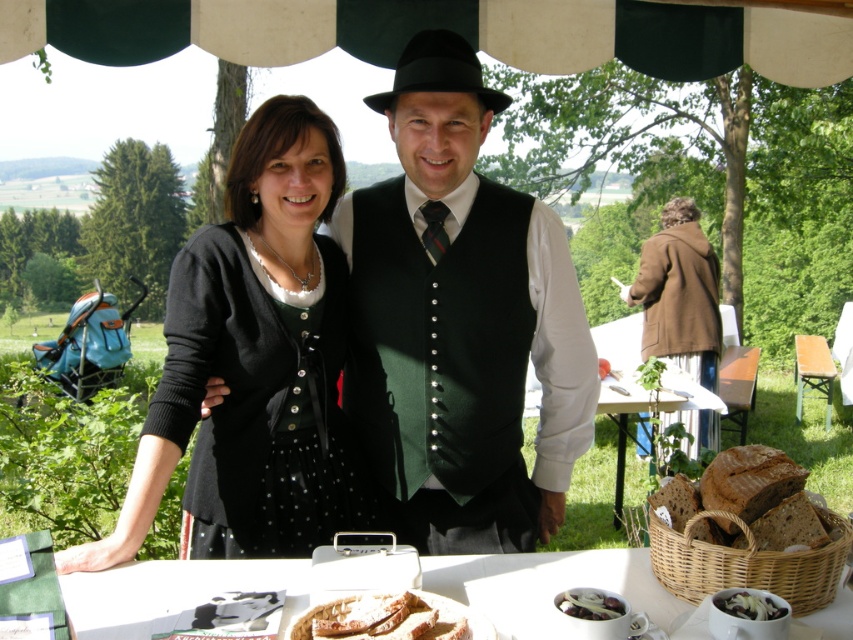
Which of these two, black dotted fabric dress at left or white creamy cheese at lower right, stands taller?

black dotted fabric dress at left is taller.

Which is behind, point (270, 520) or point (737, 600)?

Positioned behind is point (270, 520).

You are a GUI agent. You are given a task and a screenshot of the screen. Output one action in this format:
    pyautogui.click(x=<x>, y=<y>)
    Task: Click on the black dotted fabric dress at left
    Image resolution: width=853 pixels, height=640 pixels.
    Given the screenshot: What is the action you would take?
    pyautogui.click(x=276, y=417)

Consider the image. Measure the distance from black matte cardigan at center to white ceramic plate at lower center.

The distance of black matte cardigan at center from white ceramic plate at lower center is 15.73 inches.

Who is higher up, black matte cardigan at center or white ceramic plate at lower center?

black matte cardigan at center

Find the location of a particular element. Image resolution: width=853 pixels, height=640 pixels. black matte cardigan at center is located at coordinates (253, 362).

The image size is (853, 640). I want to click on black matte cardigan at center, so click(253, 362).

Does golden brown bread at center have a greater height compared to slightly toasted bread at lower center?

Yes.

Does golden brown bread at center appear on the right side of slightly toasted bread at lower center?

Incorrect, golden brown bread at center is not on the right side of slightly toasted bread at lower center.

Does point (347, 596) come closer to viewer compared to point (576, 605)?

No.

This screenshot has width=853, height=640. I want to click on golden brown bread at center, so pyautogui.click(x=387, y=627).